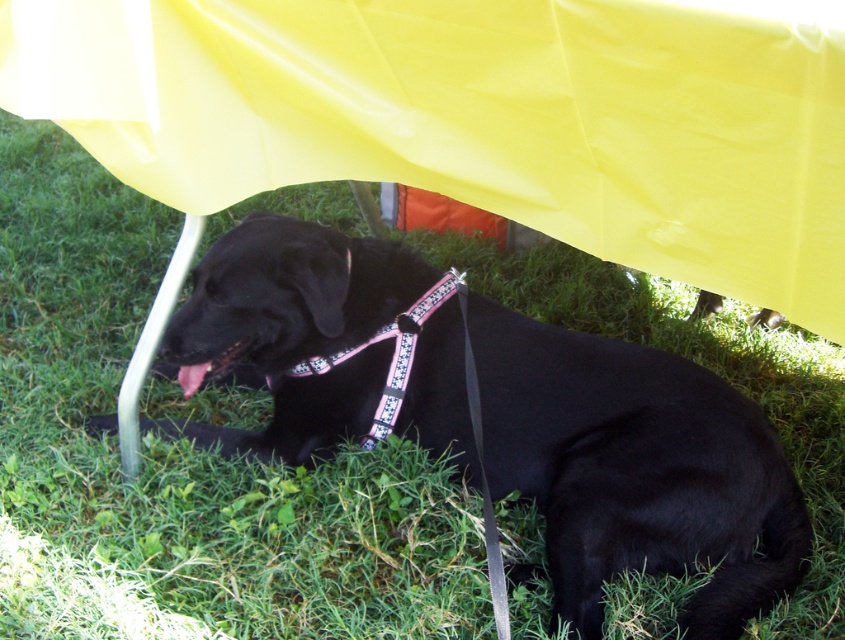
Who is positioned more to the right, black fabric dog at center or pink fabric neckband at center?

black fabric dog at center

What do you see at coordinates (636, 468) in the screenshot? The width and height of the screenshot is (845, 640). I see `black fabric dog at center` at bounding box center [636, 468].

At what (x,y) coordinates should I click in order to perform the action: click on black fabric dog at center. Please return your answer as a coordinate pair (x, y). Looking at the image, I should click on (636, 468).